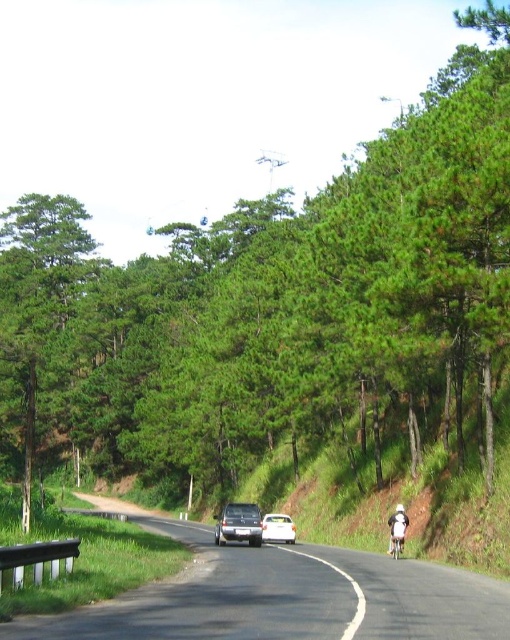
Question: From the image, what is the correct spatial relationship of black asphalt road at center in relation to metallic silver bicycle at lower right?

Choices:
 (A) above
 (B) below

Answer: (B)

Question: Which of the following is the closest to the observer?

Choices:
 (A) green matte tree at left
 (B) metallic silver bicycle at lower right
 (C) white glossy car at center
 (D) black asphalt road at center

Answer: (D)

Question: Among these points, which one is nearest to the camera?

Choices:
 (A) (390, 541)
 (B) (59, 349)
 (C) (275, 518)

Answer: (A)

Question: Which object is the closest to the satin silver sedan at center?

Choices:
 (A) green matte tree at left
 (B) metallic silver bicycle at lower right

Answer: (B)

Question: In this image, where is satin silver sedan at center located relative to white glossy car at center?

Choices:
 (A) above
 (B) below

Answer: (B)

Question: Does green matte tree at left have a lesser width compared to metallic silver bicycle at lower right?

Choices:
 (A) no
 (B) yes

Answer: (A)